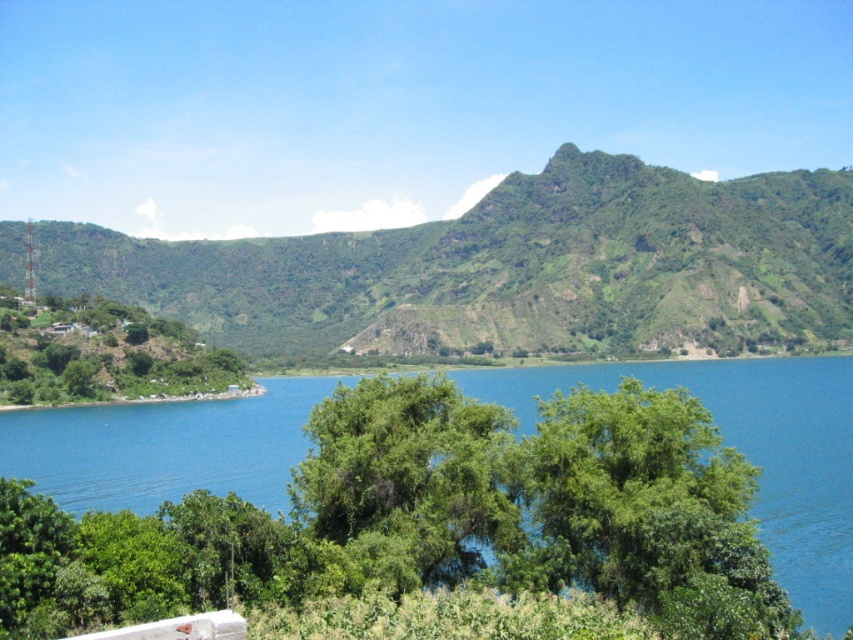
Based on the photo, between green leafy mountain at center and blue water at center, which one has more height?

With more height is green leafy mountain at center.

Image resolution: width=853 pixels, height=640 pixels. Find the location of `green leafy mountain at center`. green leafy mountain at center is located at coordinates (511, 268).

Is point (438, 260) positioned after point (248, 468)?

Yes, point (438, 260) is behind point (248, 468).

This screenshot has width=853, height=640. I want to click on green leafy mountain at center, so pyautogui.click(x=511, y=268).

In the scene shown: Is green leafy tree at center wider than green leafy tree at left?

No.

Between point (393, 529) and point (35, 394), which one is positioned behind?

The point (35, 394) is more distant.

What are the coordinates of `green leafy tree at center` in the screenshot? It's located at (409, 480).

Is blue water at center to the right of green leafy tree at left from the viewer's perspective?

Correct, you'll find blue water at center to the right of green leafy tree at left.

Can you confirm if blue water at center is smaller than green leafy tree at left?

No.

I want to click on blue water at center, so click(747, 451).